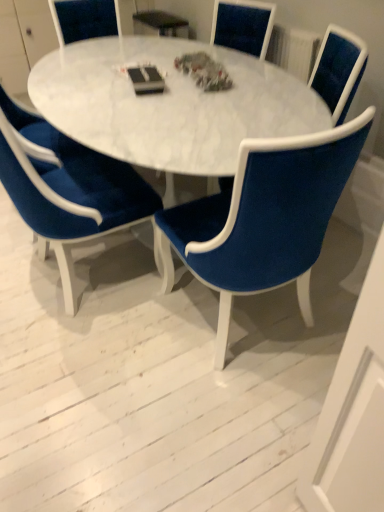
Locate an element on the screen. The image size is (384, 512). vacant space that is in between white marble table at center and velvet blue chair at center, which is the 2th chair in left-to-right order is located at coordinates (296, 318).